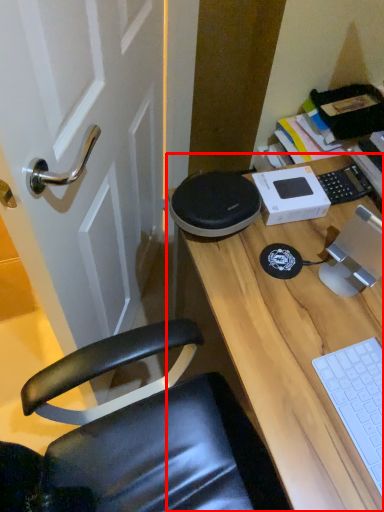
Question: From the image's perspective, what is the correct spatial positioning of desk (annotated by the red box) in reference to laptop keyboard?

Choices:
 (A) above
 (B) below

Answer: (B)